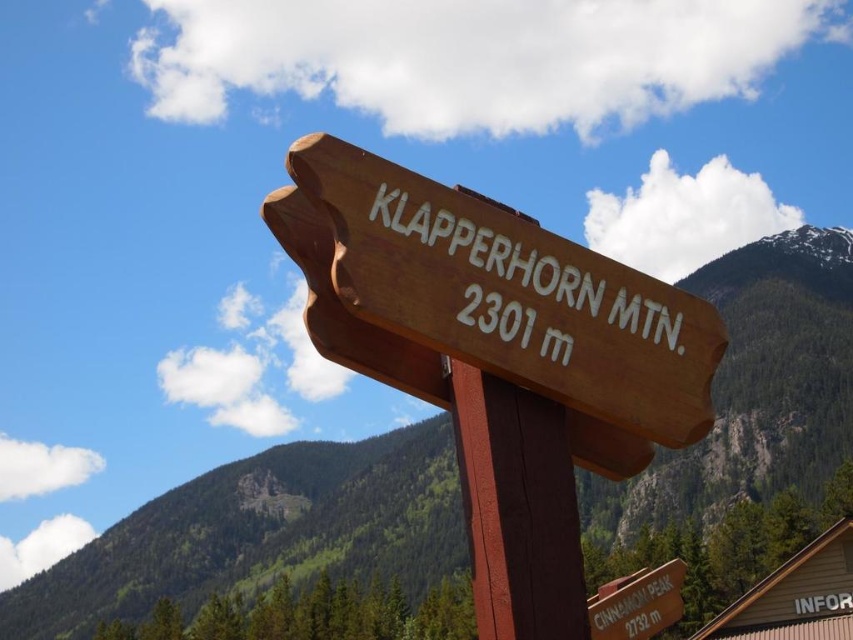
You are standing at the base of the KLAPPERHORN MTN. signpost and want to determine which of the two points, point (308, 477) or point (514, 596), is closer to you. Based on the image, which point is nearer?

Point (308, 477) is closer to you because it is further to the viewer than point (514, 596).